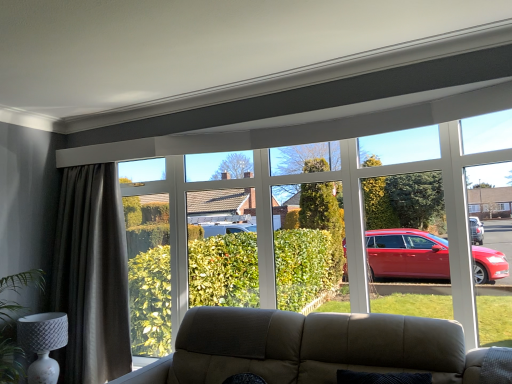
Question: From a real-world perspective, is dark grey textured curtain at left on top of transparent glass bay window at upper center?

Choices:
 (A) no
 (B) yes

Answer: (A)

Question: Is dark grey textured curtain at left completely or partially outside of transparent glass bay window at upper center?

Choices:
 (A) no
 (B) yes

Answer: (B)

Question: Is dark grey textured curtain at left directly adjacent to transparent glass bay window at upper center?

Choices:
 (A) yes
 (B) no

Answer: (B)

Question: Considering the relative positions of dark grey textured curtain at left and transparent glass bay window at upper center in the image provided, is dark grey textured curtain at left to the right of transparent glass bay window at upper center from the viewer's perspective?

Choices:
 (A) yes
 (B) no

Answer: (B)

Question: Is dark grey textured curtain at left facing away from transparent glass bay window at upper center?

Choices:
 (A) yes
 (B) no

Answer: (B)

Question: Is dark grey textured curtain at left smaller than transparent glass bay window at upper center?

Choices:
 (A) yes
 (B) no

Answer: (A)

Question: Considering the relative positions of transparent glass bay window at upper center and white textured lamp at lower left in the image provided, is transparent glass bay window at upper center to the left of white textured lamp at lower left from the viewer's perspective?

Choices:
 (A) yes
 (B) no

Answer: (B)

Question: Can you confirm if transparent glass bay window at upper center is smaller than white textured lamp at lower left?

Choices:
 (A) yes
 (B) no

Answer: (B)

Question: Does transparent glass bay window at upper center appear on the right side of white textured lamp at lower left?

Choices:
 (A) yes
 (B) no

Answer: (A)

Question: Would you say white textured lamp at lower left is part of transparent glass bay window at upper center's contents?

Choices:
 (A) no
 (B) yes

Answer: (A)

Question: Is transparent glass bay window at upper center located outside white textured lamp at lower left?

Choices:
 (A) no
 (B) yes

Answer: (B)

Question: From the image's perspective, does transparent glass bay window at upper center appear lower than white textured lamp at lower left?

Choices:
 (A) yes
 (B) no

Answer: (B)

Question: From a real-world perspective, is white textured lamp at lower left located beneath dark grey textured curtain at left?

Choices:
 (A) no
 (B) yes

Answer: (B)